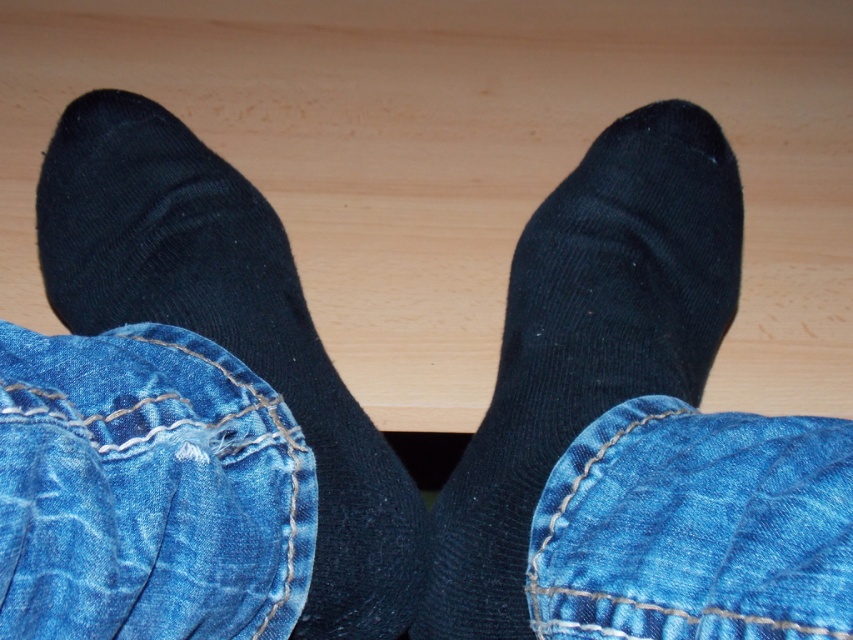
In the scene shown: You are trying to determine which sock is on top. You see the black ribbed sock at center and the black cotton sock at center. Which one is above the other?

The black cotton sock at center is above the black ribbed sock at center because the black ribbed sock at center is positioned under it.

You are a photographer adjusting the focus of your camera to capture the black ribbed sock at center. What are the coordinates where you should focus the camera?

The coordinates to focus the camera should be set to point (585, 342), as that is the 2D location of the black ribbed sock at center.